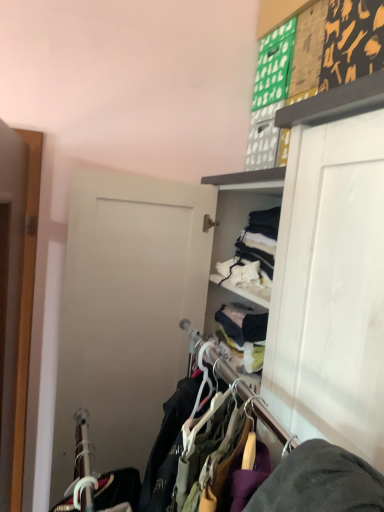
Question: From a real-world perspective, is wooden door at left located beneath wooden hangers at center?

Choices:
 (A) yes
 (B) no

Answer: (B)

Question: Is wooden door at left at the right side of wooden hangers at center?

Choices:
 (A) no
 (B) yes

Answer: (A)

Question: Could you tell me if wooden door at left is turned towards wooden hangers at center?

Choices:
 (A) no
 (B) yes

Answer: (A)

Question: Considering the relative sizes of wooden door at left and wooden hangers at center in the image provided, is wooden door at left smaller than wooden hangers at center?

Choices:
 (A) yes
 (B) no

Answer: (A)

Question: Is the depth of wooden door at left less than that of wooden hangers at center?

Choices:
 (A) no
 (B) yes

Answer: (A)

Question: Is wooden door at left not within wooden hangers at center?

Choices:
 (A) yes
 (B) no

Answer: (A)

Question: From the image's perspective, is wooden hangers at center above wooden door at left?

Choices:
 (A) yes
 (B) no

Answer: (B)

Question: Is wooden hangers at center bigger than wooden door at left?

Choices:
 (A) no
 (B) yes

Answer: (B)

Question: Is wooden hangers at center wider than wooden door at left?

Choices:
 (A) no
 (B) yes

Answer: (B)

Question: Would you say wooden hangers at center is a long distance from wooden door at left?

Choices:
 (A) no
 (B) yes

Answer: (A)

Question: Is wooden hangers at center turned away from wooden door at left?

Choices:
 (A) yes
 (B) no

Answer: (B)

Question: Is wooden hangers at center aimed at wooden door at left?

Choices:
 (A) no
 (B) yes

Answer: (B)

Question: Considering the positions of wooden door at left and wooden hangers at center in the image, is wooden door at left bigger or smaller than wooden hangers at center?

Choices:
 (A) small
 (B) big

Answer: (A)